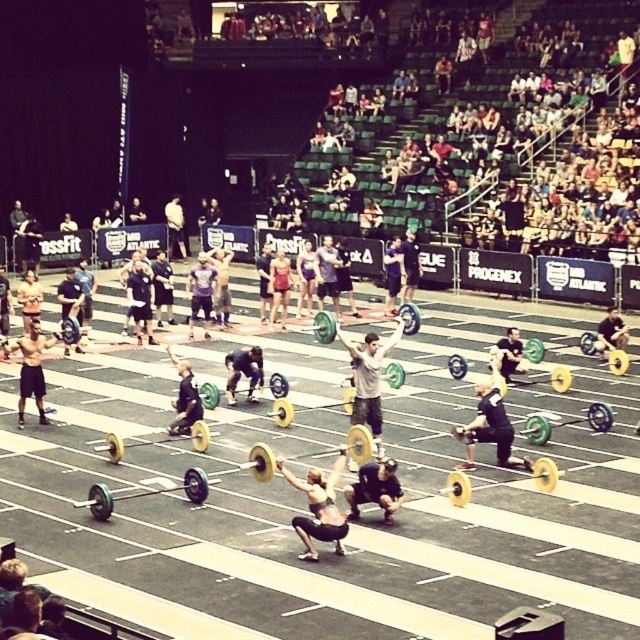
You are an athlete participating in the CrossFit competition. You need to quickly retrieve your yellow rubber barbell at center from where you are standing wearing shiny black shorts at center. Can you reach it without moving more than 8 meters?

The shiny black shorts at center and yellow rubber barbell at center are 8.65 meters apart, which is more than 8 meters. Therefore, you cannot reach the yellow rubber barbell at center without moving more than 8 meters.